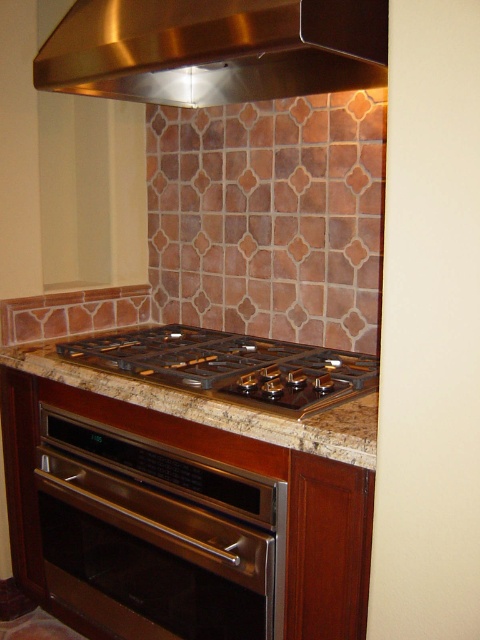
Question: Which point is farther to the camera?

Choices:
 (A) stainless steel oven at lower left
 (B) marble/granite counter top at center

Answer: (A)

Question: Which of the following is the closest to the observer?

Choices:
 (A) marble/granite counter top at center
 (B) stainless steel exhaust hood at upper center

Answer: (B)

Question: Which object appears closest to the camera in this image?

Choices:
 (A) stainless steel oven at lower left
 (B) marble/granite counter top at center

Answer: (B)

Question: Is stainless steel oven at lower left in front of marble/granite counter top at center?

Choices:
 (A) yes
 (B) no

Answer: (B)

Question: In this image, where is stainless steel oven at lower left located relative to marble/granite counter top at center?

Choices:
 (A) above
 (B) below

Answer: (B)

Question: Is stainless steel oven at lower left to the right of marble/granite counter top at center from the viewer's perspective?

Choices:
 (A) yes
 (B) no

Answer: (B)